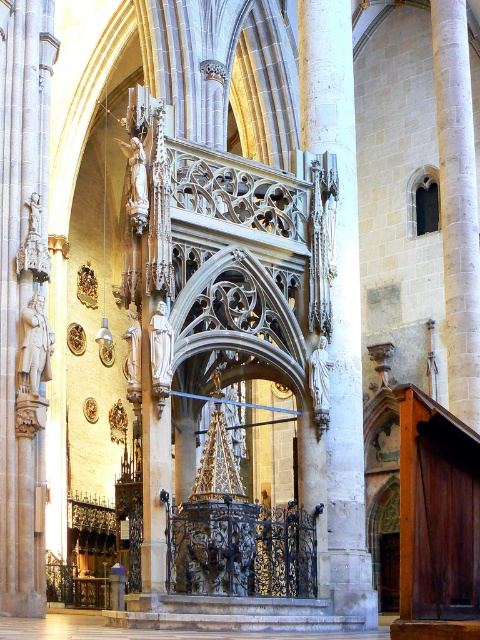
Is polished stone statue at left thinner than white stone column at center?

Yes.

Between point (10, 90) and point (352, 321), which one is positioned behind?

The point (352, 321) is more distant.

You are a GUI agent. You are given a task and a screenshot of the screen. Output one action in this format:
    pyautogui.click(x=<x>, y=<y>)
    Task: Click on the polished stone statue at left
    
    Given the screenshot: What is the action you would take?
    pyautogui.click(x=24, y=298)

Is polished bronze statue at left thinner than white marble statue at right?

Yes.

Does polished bronze statue at left have a greater height compared to white marble statue at right?

In fact, polished bronze statue at left may be shorter than white marble statue at right.

Find the location of a particular element. polished bronze statue at left is located at coordinates (35, 346).

Does white stone column at center appear on the left side of polished bronze statue at left?

No, white stone column at center is not to the left of polished bronze statue at left.

Where is `white stone column at center`? The height and width of the screenshot is (640, 480). white stone column at center is located at coordinates (339, 296).

Measure the distance between white stone column at center and camera.

white stone column at center is 57.44 meters from camera.

Image resolution: width=480 pixels, height=640 pixels. Identify the location of white stone column at center. (339, 296).